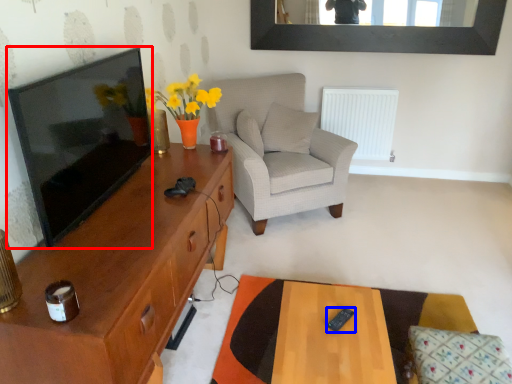
Question: Which object appears closest to the camera in this image, television (highlighted by a red box) or remote control (highlighted by a blue box)?

Choices:
 (A) television
 (B) remote control

Answer: (A)